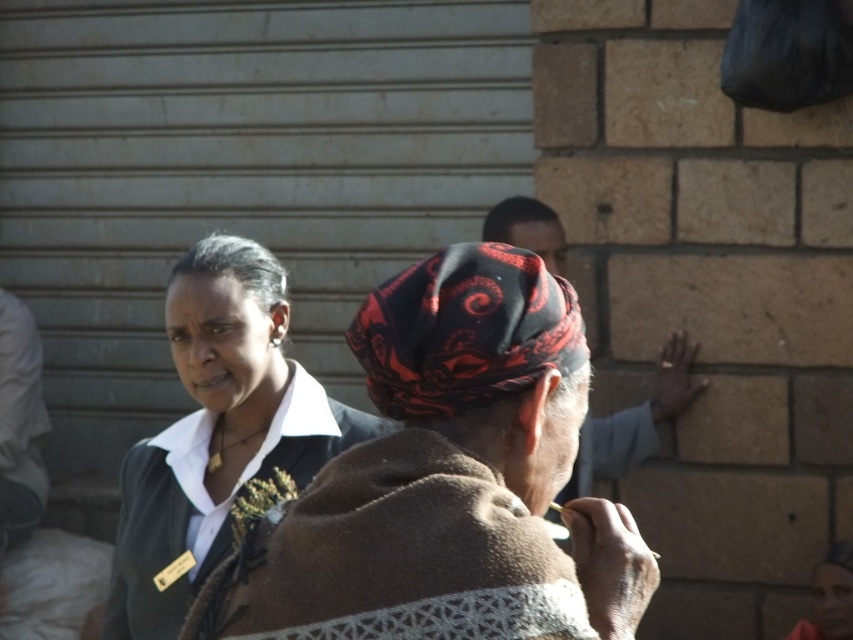
Question: Which point is closer to the camera taking this photo?

Choices:
 (A) [x=497, y=230]
 (B) [x=262, y=509]
 (C) [x=474, y=298]
 (D) [x=509, y=608]

Answer: (D)

Question: Among these points, which one is nearest to the camera?

Choices:
 (A) (206, 324)
 (B) (596, 595)
 (C) (387, 332)
 (D) (521, 232)

Answer: (B)

Question: Which of the following is the closest to the observer?

Choices:
 (A) (410, 406)
 (B) (311, 400)

Answer: (A)

Question: Can you confirm if brown woolen shawl at center is positioned to the right of black matte jacket at center?

Choices:
 (A) yes
 (B) no

Answer: (A)

Question: Considering the relative positions of black woven headscarf at center and red-patterned headscarf at center in the image provided, where is black woven headscarf at center located with respect to red-patterned headscarf at center?

Choices:
 (A) below
 (B) above

Answer: (B)

Question: Does brown woolen shawl at center come behind black matte jacket at center?

Choices:
 (A) no
 (B) yes

Answer: (A)